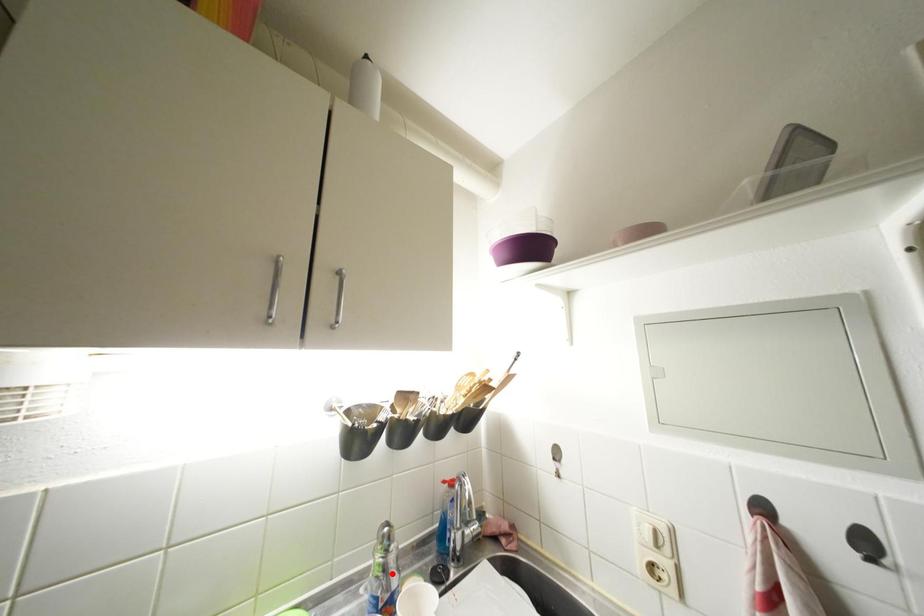
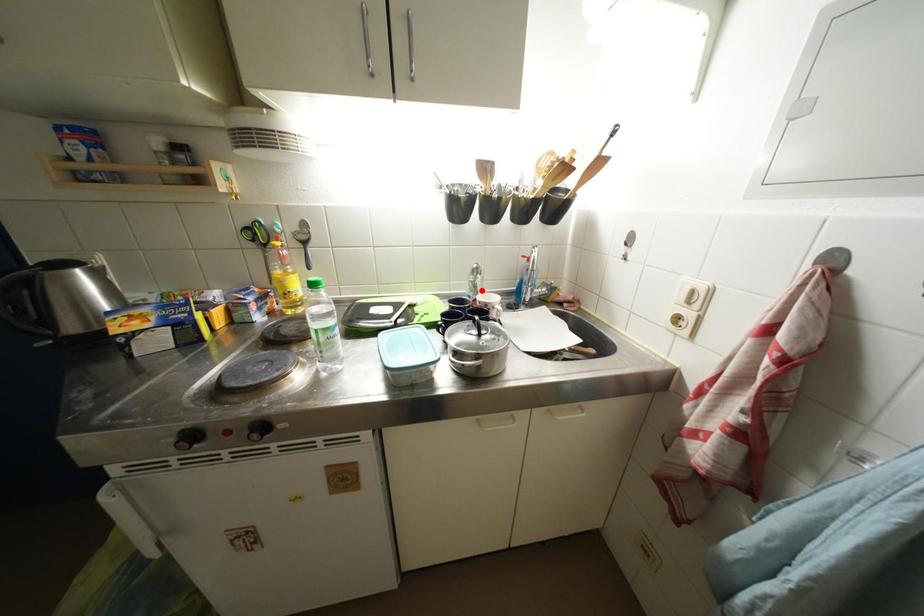
I am providing you with two images of the same scene from different viewpoints. A red point is marked on the first image and another point is marked on the second image. Do the highlighted points in image1 and image2 indicate the same real-world spot?

Yes